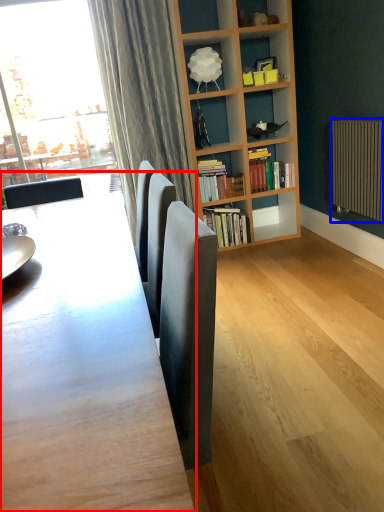
Question: Which object is further to the camera taking this photo, table (highlighted by a red box) or radiator (highlighted by a blue box)?

Choices:
 (A) table
 (B) radiator

Answer: (B)